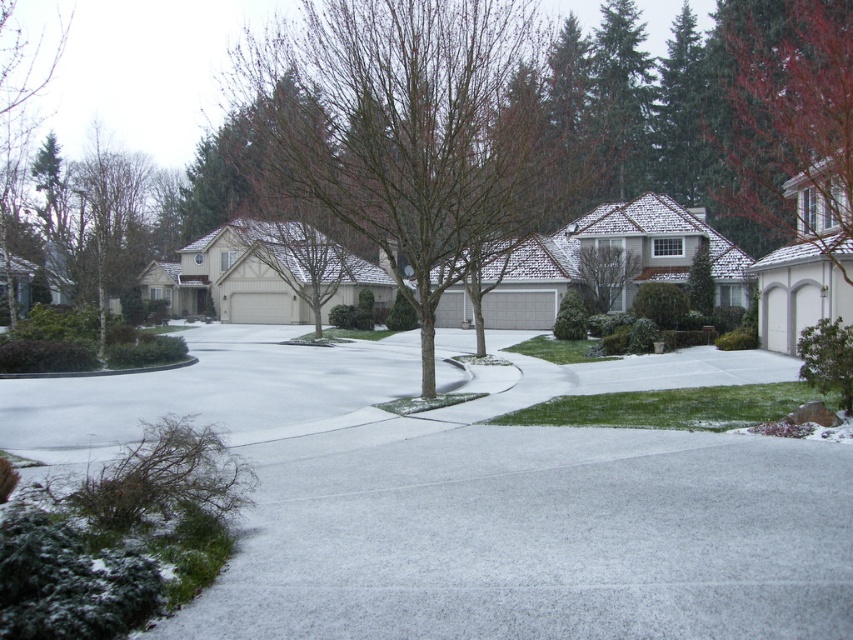
You are a delivery person trying to navigate through the residential street. You see the bare branches at center and the red matte tree at upper right. Which object is closer to you as you walk along the sidewalk?

The bare branches at center is closer to you because it is further to the viewer than the red matte tree at upper right, meaning it appears nearer in the scene.

You are a delivery person trying to avoid stepping on the snow. You need to walk from the road to the sidewalk. Which direction should you head relative to the white textured pavement at lower center and the bare branches at center?

You should head below the bare branches at center because the white textured pavement at lower center is located below them, which is part of the sidewalk or path free of snow.